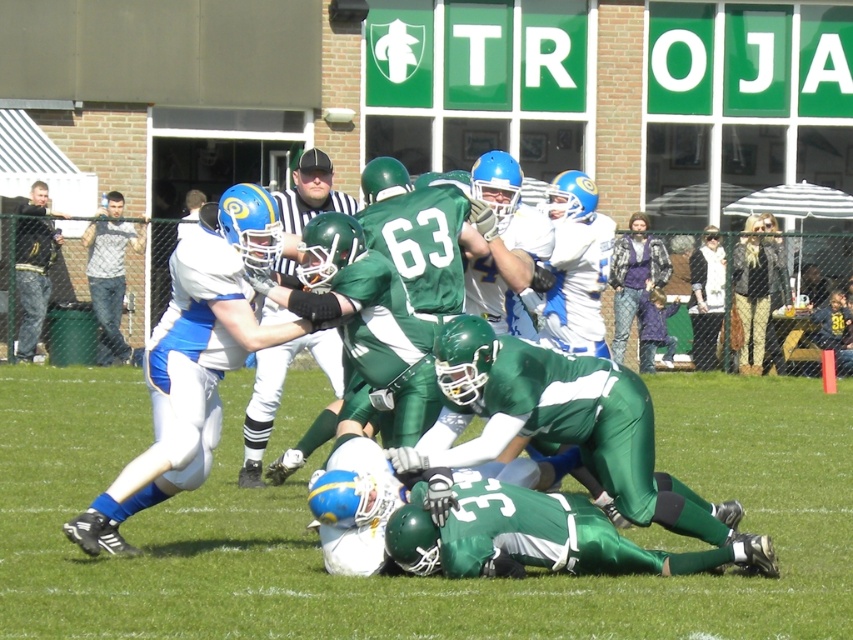
Who is taller, black striped shirt at center or gray checkered shirt at left?

Standing taller between the two is gray checkered shirt at left.

Which is below, black striped shirt at center or gray checkered shirt at left?

black striped shirt at center is lower down.

Where is `black striped shirt at center`? This screenshot has width=853, height=640. black striped shirt at center is located at coordinates (280, 394).

Does shiny green helmet at center have a larger size compared to gray checkered shirt at left?

Yes.

Is point (624, 486) positioned in front of point (97, 314)?

Yes, it is.

Is point (548, 349) more distant than point (120, 349)?

No, it is not.

The height and width of the screenshot is (640, 853). Identify the location of shiny green helmet at center. (572, 436).

The height and width of the screenshot is (640, 853). Describe the element at coordinates (280, 394) in the screenshot. I see `black striped shirt at center` at that location.

Locate an element on the screen. The height and width of the screenshot is (640, 853). black striped shirt at center is located at coordinates (280, 394).